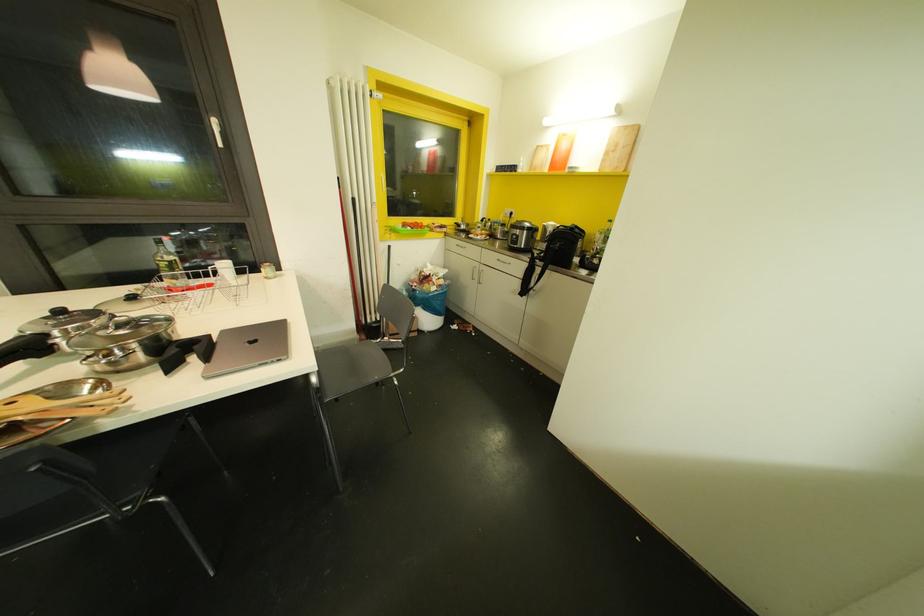
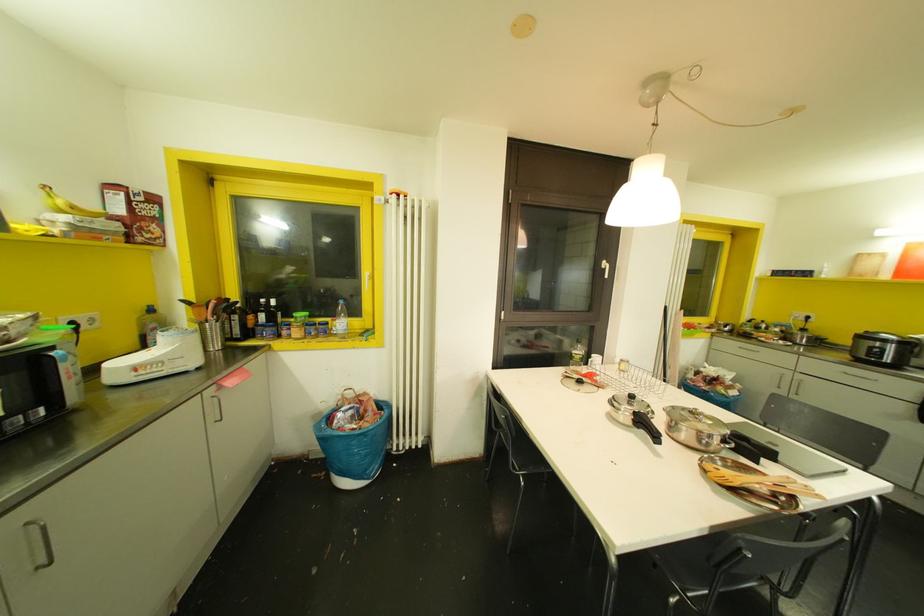
In the second image, find the point that corresponds to pixel 513 225 in the first image.

(861, 336)